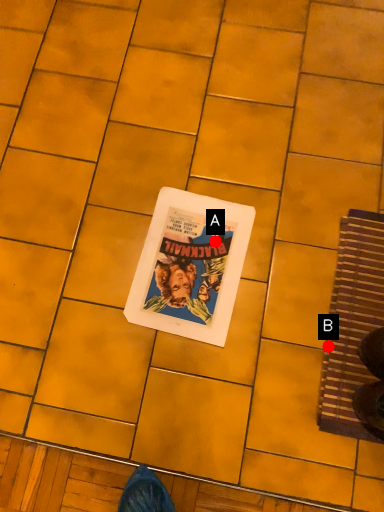
Question: Two points are circled on the image, labeled by A and B beside each circle. Which point is farther to the camera?

Choices:
 (A) A is further
 (B) B is further

Answer: (A)